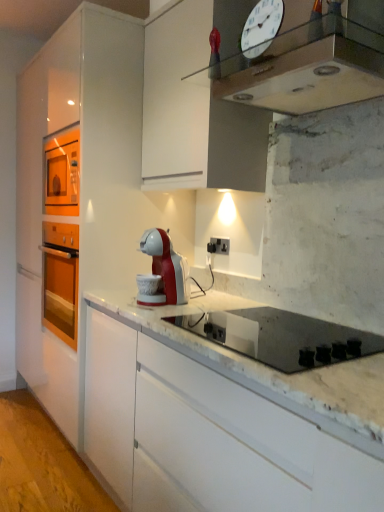
This screenshot has height=512, width=384. What are the coordinates of `free spot above white marble countertop at lower left (from a real-world perspective)` in the screenshot? It's located at (33, 442).